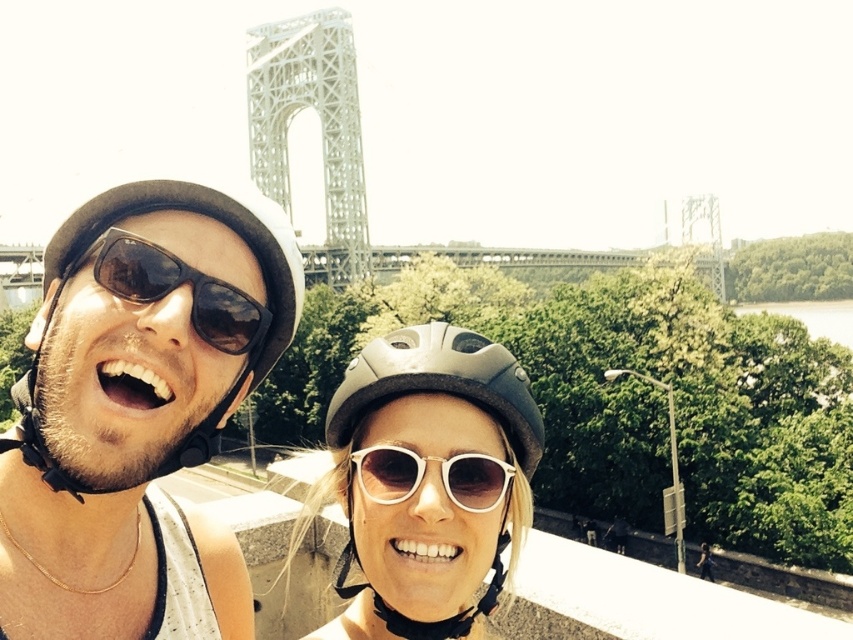
Question: Observing the image, what is the correct spatial positioning of white metal structure at upper center in reference to white plastic sunglasses at center?

Choices:
 (A) below
 (B) above

Answer: (B)

Question: Can you confirm if matte black helmet at left is smaller than matte black helmet at center?

Choices:
 (A) no
 (B) yes

Answer: (A)

Question: Which of the following is the farthest from the observer?

Choices:
 (A) white metal structure at upper center
 (B) matte black helmet at center
 (C) black matte sunglasses at center

Answer: (A)

Question: Considering the real-world distances, which object is closest to the black matte sunglasses at center?

Choices:
 (A) matte black helmet at center
 (B) white plastic sunglasses at center

Answer: (A)

Question: Which of the following is the farthest from the observer?

Choices:
 (A) (466, 502)
 (B) (177, 461)
 (C) (125, 273)

Answer: (A)

Question: From the image, what is the correct spatial relationship of matte black helmet at left in relation to white plastic sunglasses at center?

Choices:
 (A) above
 (B) below

Answer: (A)